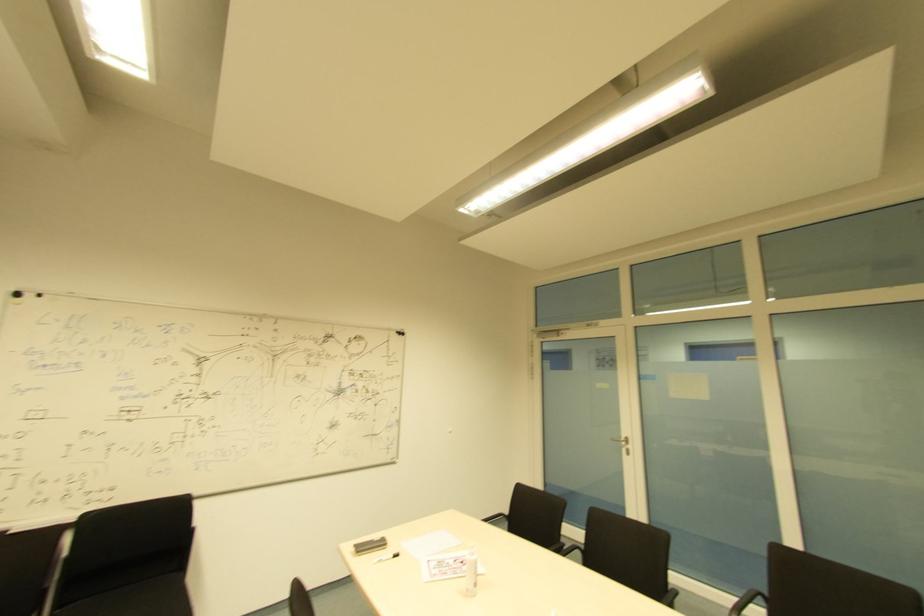
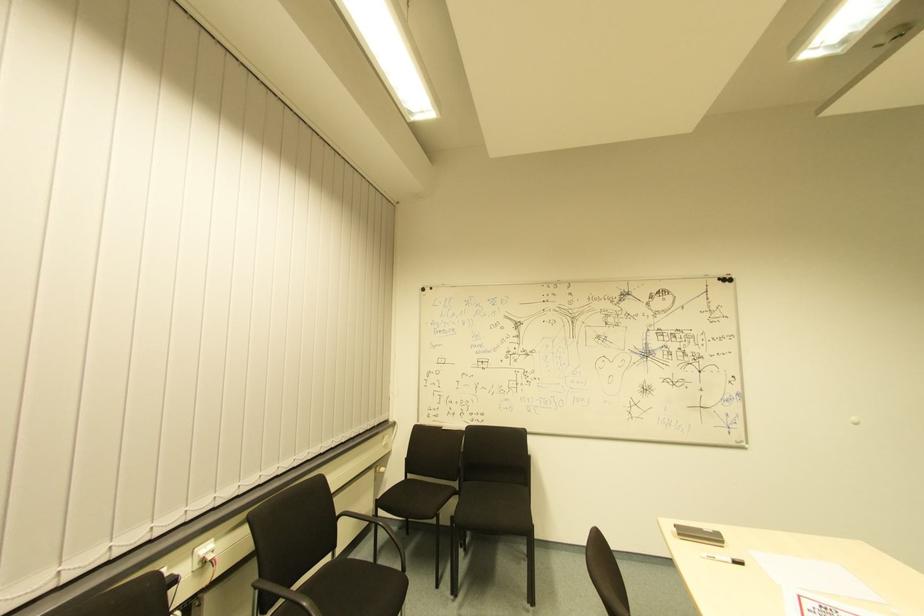
In the second image, find the point that corresponds to the point at 396,557 in the first image.

(737, 565)